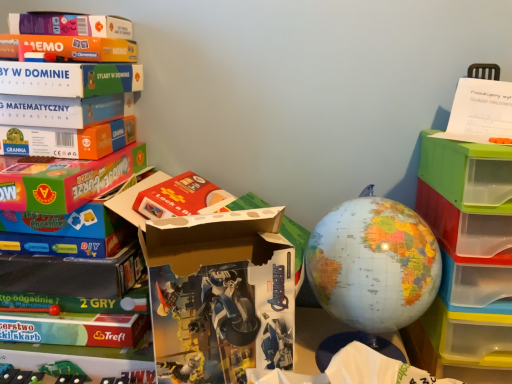
Question: Are matte plastic globe at center and translucent plastic drawers at right beside each other?

Choices:
 (A) yes
 (B) no

Answer: (B)

Question: Does matte plastic globe at center contain translucent plastic drawers at right?

Choices:
 (A) yes
 (B) no

Answer: (B)

Question: Is the position of matte plastic globe at center more distant than that of translucent plastic drawers at right?

Choices:
 (A) no
 (B) yes

Answer: (B)

Question: From a real-world perspective, is matte plastic globe at center located beneath translucent plastic drawers at right?

Choices:
 (A) yes
 (B) no

Answer: (B)

Question: Does matte plastic globe at center come in front of translucent plastic drawers at right?

Choices:
 (A) yes
 (B) no

Answer: (B)

Question: From their relative heights in the image, would you say white cardboard box at center is taller or shorter than matte plastic globe at center?

Choices:
 (A) tall
 (B) short

Answer: (A)

Question: Considering the positions of white cardboard box at center and matte plastic globe at center in the image, is white cardboard box at center wider or thinner than matte plastic globe at center?

Choices:
 (A) thin
 (B) wide

Answer: (A)

Question: Is white cardboard box at center inside the boundaries of matte plastic globe at center, or outside?

Choices:
 (A) inside
 (B) outside

Answer: (B)

Question: Based on their positions, is white cardboard box at center located to the left or right of matte plastic globe at center?

Choices:
 (A) right
 (B) left

Answer: (B)

Question: In the image, is translucent plastic drawers at right positioned in front of or behind white cardboard box at center?

Choices:
 (A) behind
 (B) front

Answer: (A)

Question: Considering the positions of translucent plastic drawers at right and white cardboard box at center in the image, is translucent plastic drawers at right wider or thinner than white cardboard box at center?

Choices:
 (A) thin
 (B) wide

Answer: (B)

Question: Is point tap(484, 155) positioned closer to the camera than point tap(215, 344)?

Choices:
 (A) closer
 (B) farther

Answer: (B)

Question: Based on their sizes in the image, would you say translucent plastic drawers at right is bigger or smaller than white cardboard box at center?

Choices:
 (A) big
 (B) small

Answer: (A)

Question: Would you say white paper at upper right is to the left or to the right of translucent plastic drawers at right in the picture?

Choices:
 (A) left
 (B) right

Answer: (B)

Question: Relative to translucent plastic drawers at right, is white paper at upper right in front or behind?

Choices:
 (A) front
 (B) behind

Answer: (B)